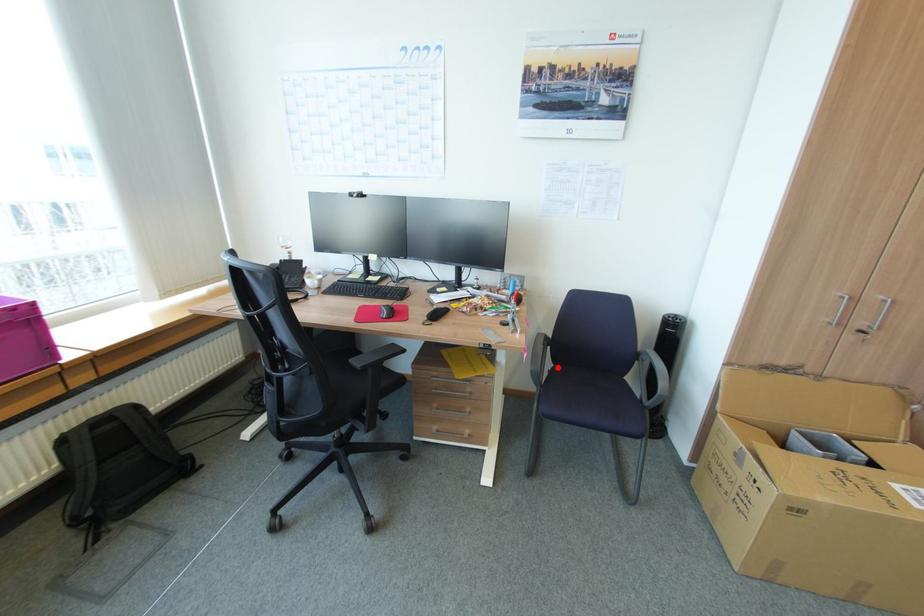
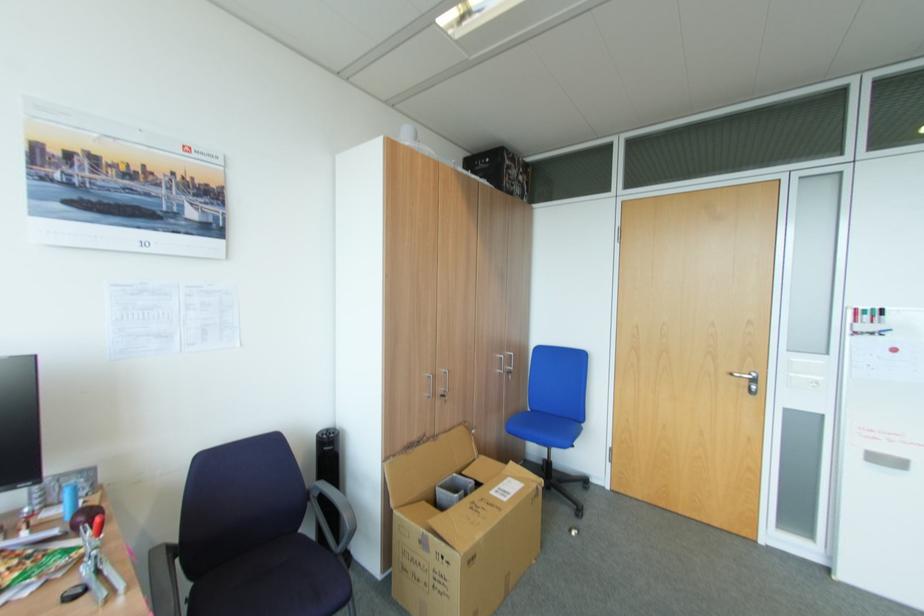
Find the pixel in the second image that matches the highlighted location in the first image.

(198, 588)